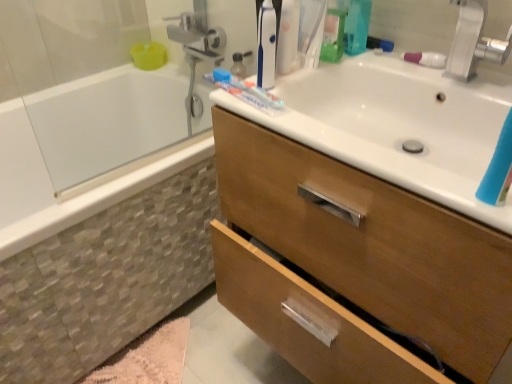
The image size is (512, 384). Find the location of `vacant space situated on the left part of pink plastic toothbrush at upper right`. vacant space situated on the left part of pink plastic toothbrush at upper right is located at coordinates (362, 62).